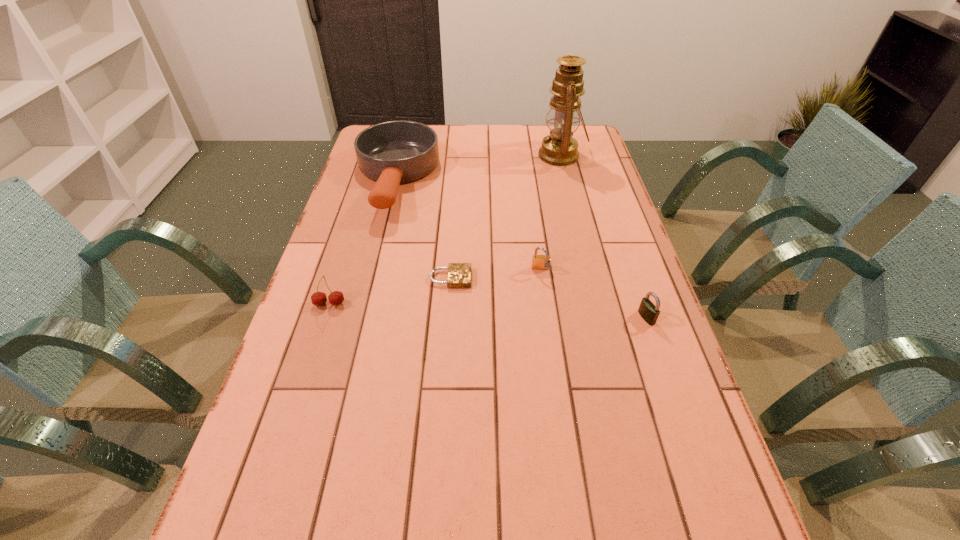
Where is `blank area located 0.050m on the handle side of the pan`? blank area located 0.050m on the handle side of the pan is located at coordinates (382, 235).

I want to click on vacant space located 0.190m on the surface of the cherry, so click(x=306, y=376).

Image resolution: width=960 pixels, height=540 pixels. Identify the location of vacant region located on the side with the combination dials of the third object from right to left. (554, 366).

Locate an element on the screen. This screenshot has width=960, height=540. free spot located on the left of the nearest padlock is located at coordinates (583, 318).

Where is `free space located 0.240m on the keyhole side of the fourth object from right to left`? The image size is (960, 540). free space located 0.240m on the keyhole side of the fourth object from right to left is located at coordinates (562, 278).

At what (x,y) coordinates should I click in order to perform the action: click on oil lamp located in the far edge section of the desktop. Please return your answer as a coordinate pair (x, y). This screenshot has height=540, width=960. Looking at the image, I should click on (559, 148).

Locate an element on the screen. Image resolution: width=960 pixels, height=540 pixels. pan situated at the far edge is located at coordinates (393, 152).

The width and height of the screenshot is (960, 540). In order to click on pan that is positioned at the left edge in this screenshot , I will do `click(393, 152)`.

Identify the location of cherry that is at the left edge. The height and width of the screenshot is (540, 960). (336, 298).

Where is `oil lamp at the right edge`? oil lamp at the right edge is located at coordinates (559, 148).